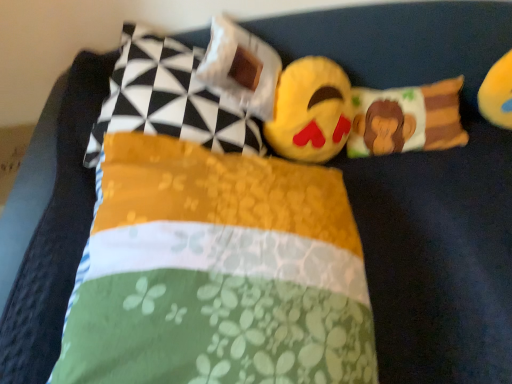
Question: Visually, is soft plush emoji at center, acting as the second toy starting from the right, positioned to the left or to the right of white fabric pillow at upper center, positioned as the third pillow in right-to-left order?

Choices:
 (A) right
 (B) left

Answer: (A)

Question: From the image's perspective, is soft plush emoji at center, acting as the second toy starting from the right, located above or below white fabric pillow at upper center, the second pillow positioned from the left?

Choices:
 (A) below
 (B) above

Answer: (A)

Question: Which object is the farthest from the fluffy fabric monkey pillow at center, arranged as the fourth pillow when viewed from the left?

Choices:
 (A) white fabric pillow at upper center, positioned as the third pillow in right-to-left order
 (B) yellow plush toy at upper right, acting as the 2th toy starting from the left
 (C) yellow fabric pillow at upper left, which ranks as the first pillow in left-to-right order
 (D) soft plush emoji at center, the first toy when ordered from left to right
 (E) floral fabric pillow at center, marked as the second pillow in a right-to-left arrangement

Answer: (E)

Question: Estimate the real-world distances between objects in this image. Which object is closer to the yellow plush toy at upper right, which appears as the 1th toy when viewed from the right?

Choices:
 (A) yellow fabric pillow at upper left, the fourth pillow in the right-to-left sequence
 (B) soft plush emoji at center, the first toy when ordered from left to right
 (C) floral fabric pillow at center, marked as the second pillow in a right-to-left arrangement
 (D) white fabric pillow at upper center, the second pillow positioned from the left
 (E) fluffy fabric monkey pillow at center, which ranks as the 1th pillow in right-to-left order

Answer: (E)